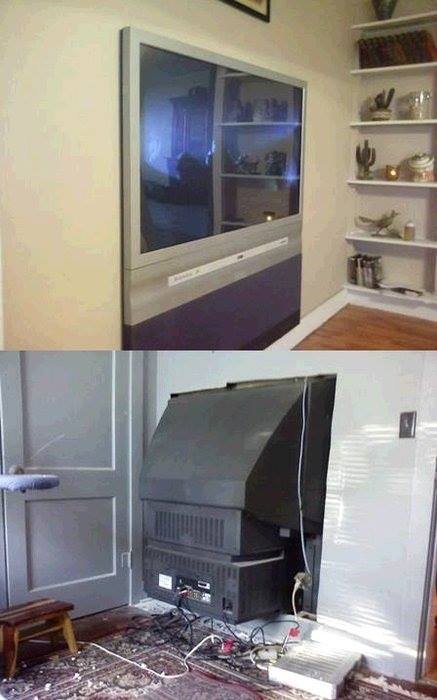
Where is `door handle`? This screenshot has width=437, height=700. door handle is located at coordinates (17, 468).